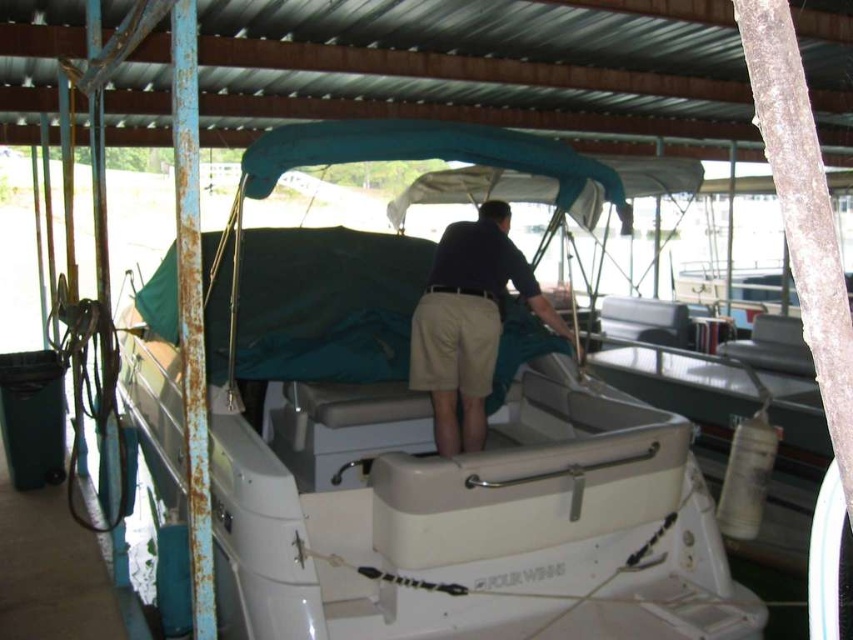
You are standing on the dock and see the white plastic boat at center and the dark blue shirt at center. Which object is positioned higher in the image?

The white plastic boat at center is positioned higher than the dark blue shirt at center in the image.

You are planning to board the white plastic boat at center and need to step over the dark blue shirt at center. Considering their heights, which one is easier to step over?

The white plastic boat at center is much taller than the dark blue shirt at center, so it would be harder to step over the white plastic boat at center compared to the dark blue shirt at center.

You are standing at the dock preparing to board the pontoon boat. The entrance is located at point [378,355]. Can you safely walk towards the entrance from your current position?

The distance between you and the entrance at point [378,355] is 4.04 meters, so yes, you can safely walk towards the entrance from your current position.